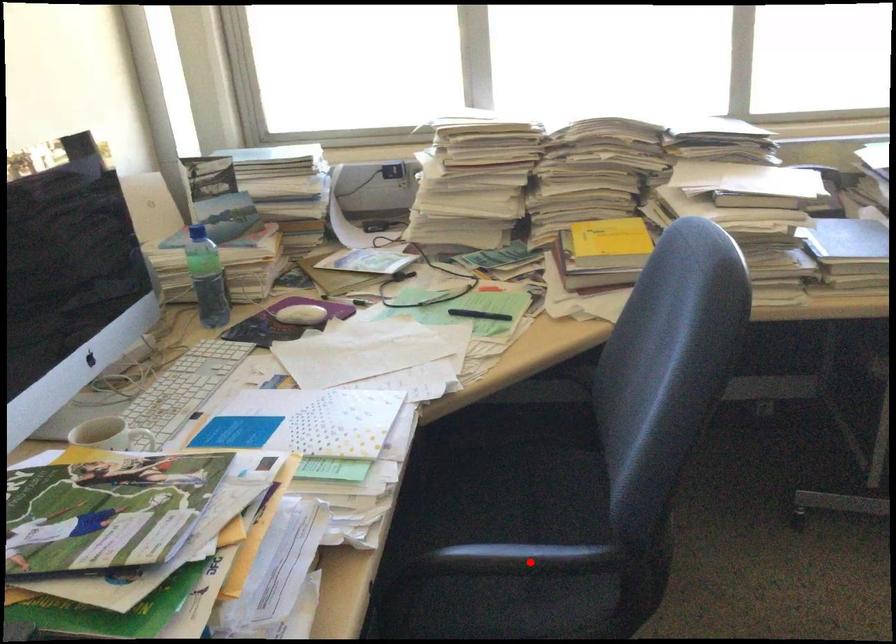
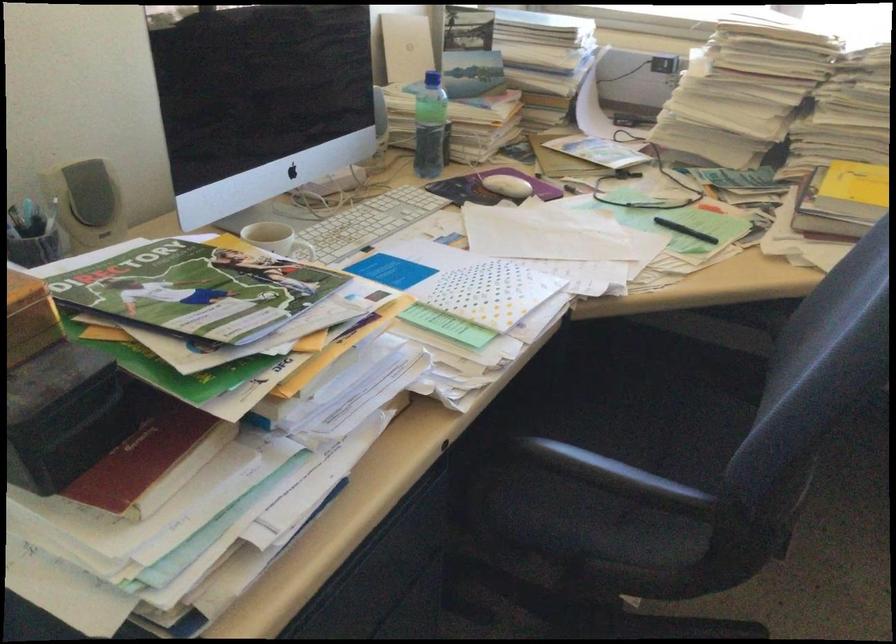
Find the pixel in the second image that matches the highlighted location in the first image.

(614, 474)